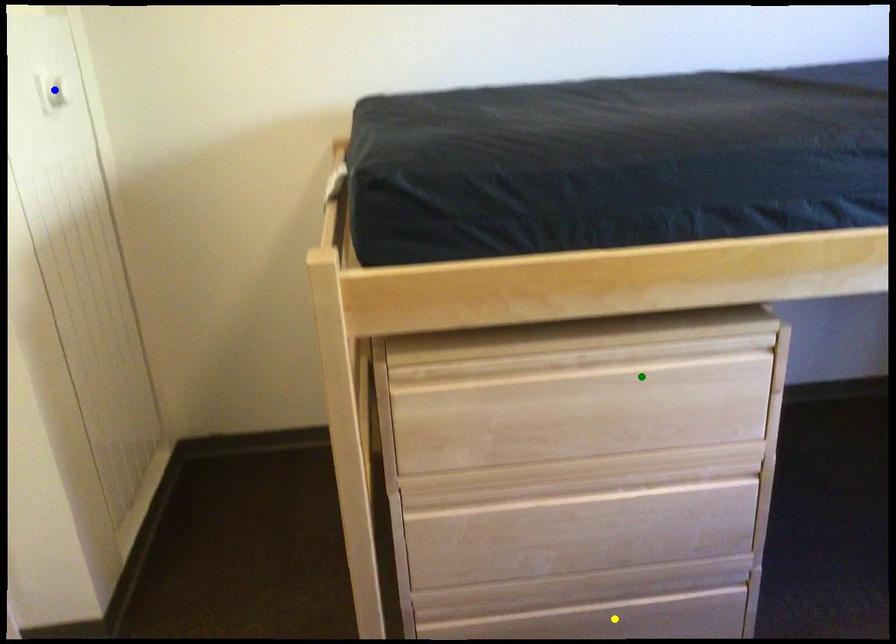
Order these from farthest to nearest:
yellow point | green point | blue point

blue point
yellow point
green point